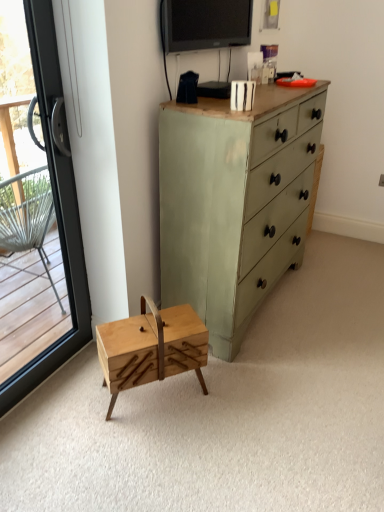
Identify the location of vacant area to the right of natural wood sewing box at center. (232, 395).